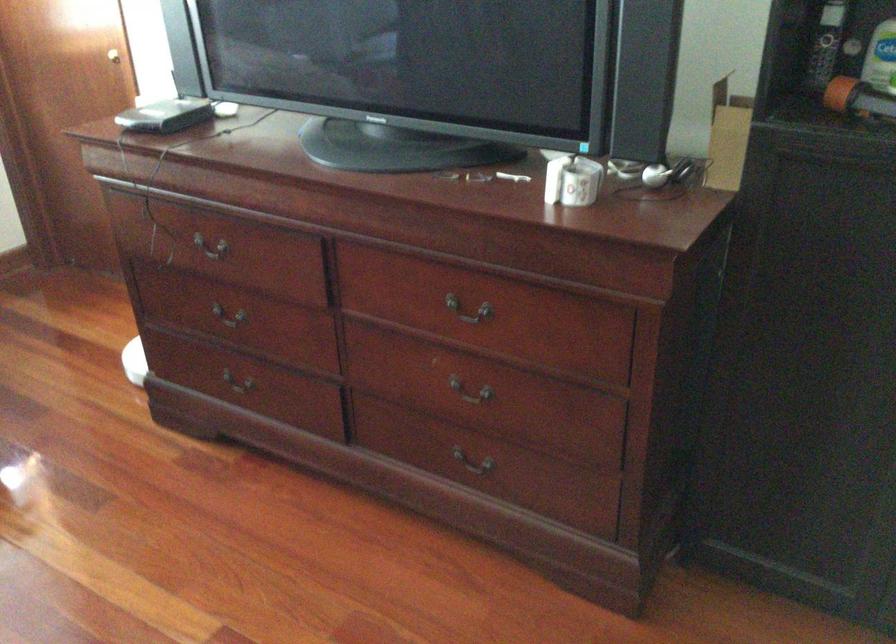
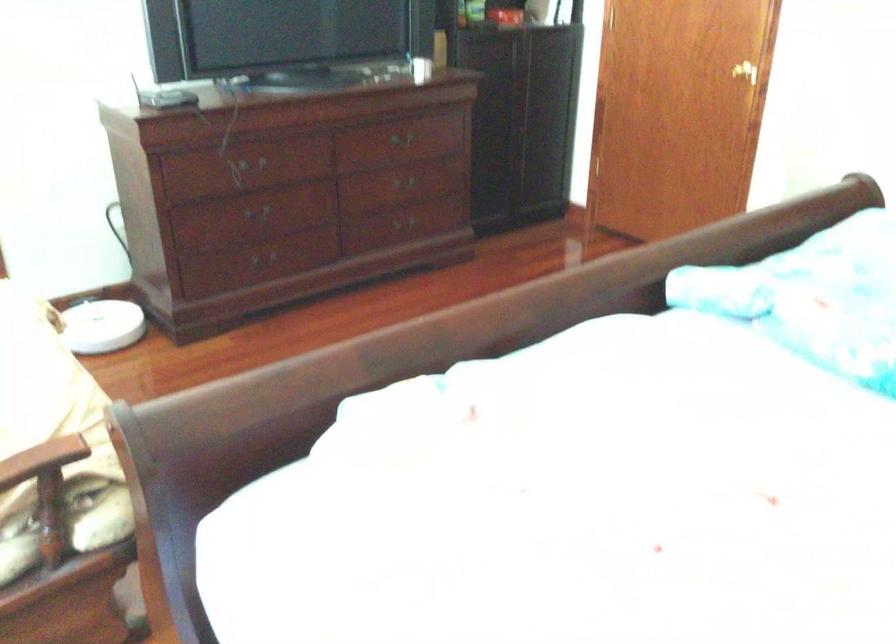
The point at (x=517, y=420) is marked in the first image. Where is the corresponding point in the second image?

(409, 187)